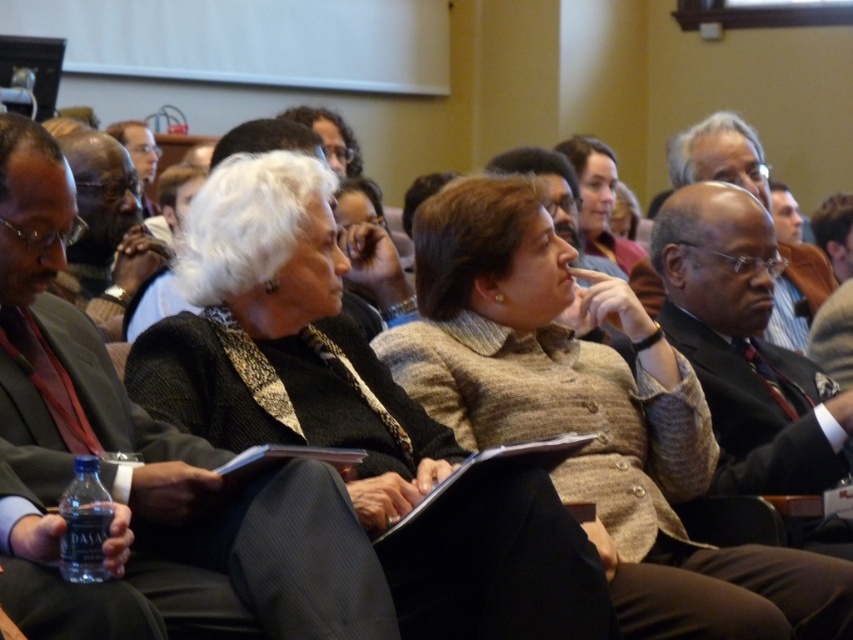
Is matte black jacket at center in front of black wool sweater at center?

No, it is not.

Between point (329, 406) and point (61, 266), which one is positioned behind?

Point (329, 406)

At what (x,y) coordinates should I click in order to perform the action: click on matte black jacket at center. Please return your answer as a coordinate pair (x, y). This screenshot has height=640, width=853. Looking at the image, I should click on [282, 339].

At what (x,y) coordinates should I click in order to perform the action: click on matte black jacket at center. Please return your answer as a coordinate pair (x, y). This screenshot has height=640, width=853. Looking at the image, I should click on (282, 339).

Measure the distance between point (318, 225) and camera.

The distance of point (318, 225) from camera is 26.37 feet.

The width and height of the screenshot is (853, 640). Identify the location of matte black jacket at center. (282, 339).

Locate an element on the screen. The image size is (853, 640). matte black jacket at center is located at coordinates (282, 339).

Who is positioned more to the left, matte black jacket at center or brown textured blazer at center?

matte black jacket at center

What are the coordinates of `matte black jacket at center` in the screenshot? It's located at (282, 339).